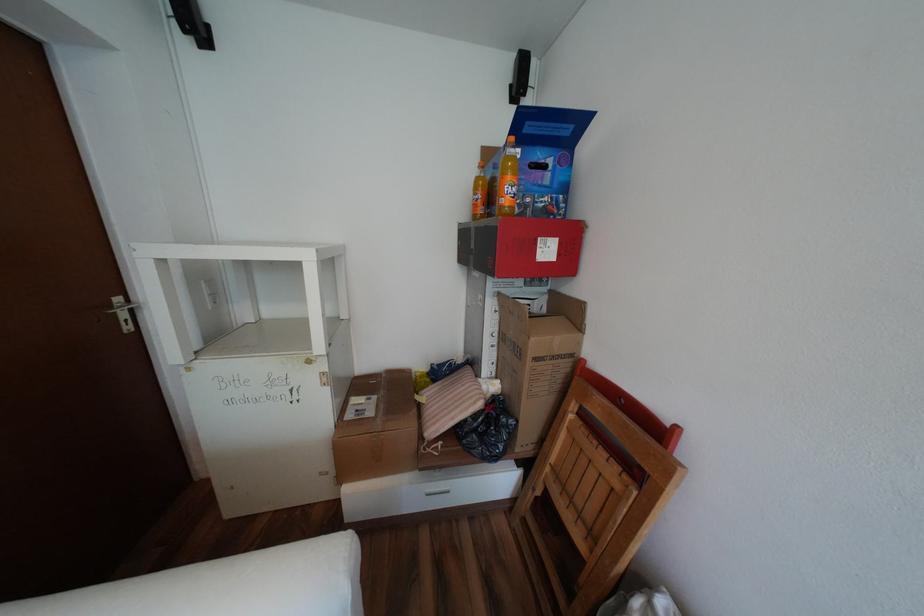
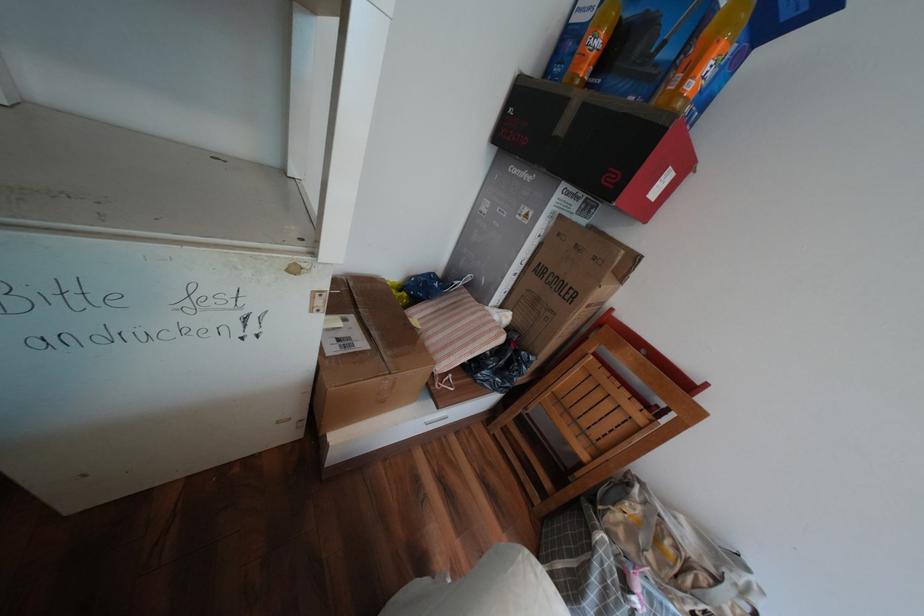
Based on the continuous images, in which direction is the camera rotating?

The camera's rotation is toward right-down.